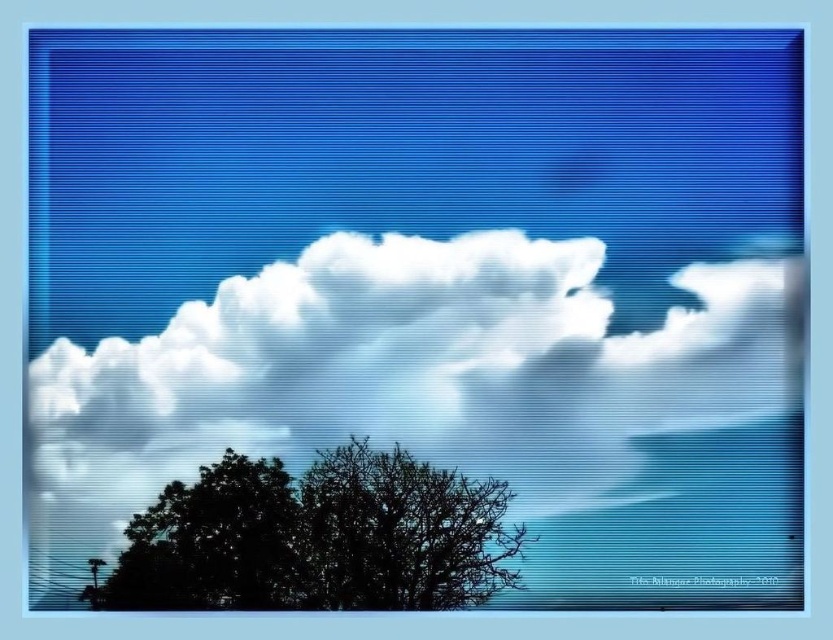
Question: Can you confirm if white fluffy cloud at upper center is smaller than silhouette leafy tree at lower left?

Choices:
 (A) yes
 (B) no

Answer: (B)

Question: Does white fluffy cloud at upper center have a smaller size compared to silhouette leafy tree at lower left?

Choices:
 (A) no
 (B) yes

Answer: (A)

Question: Which object appears farthest from the camera in this image?

Choices:
 (A) silhouette leafy tree at lower left
 (B) silhouette leafy tree at lower center

Answer: (B)

Question: Which object is closer to the camera taking this photo?

Choices:
 (A) silhouette leafy tree at lower center
 (B) silhouette leafy tree at lower left

Answer: (B)

Question: Is white fluffy cloud at upper center thinner than silhouette leafy tree at lower left?

Choices:
 (A) no
 (B) yes

Answer: (A)

Question: Which object is closer to the camera taking this photo?

Choices:
 (A) silhouette leafy tree at lower center
 (B) white fluffy cloud at upper center
 (C) silhouette leafy tree at lower left

Answer: (C)